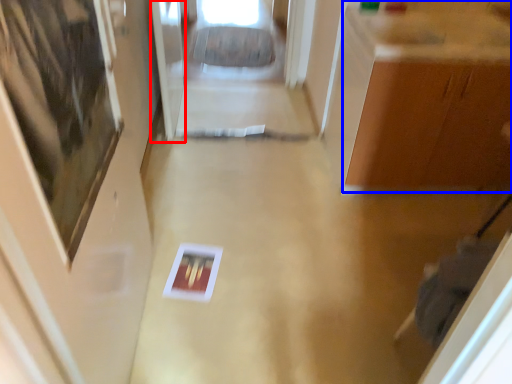
Question: Which of the following is the closest to the observer, glass door (highlighted by a red box) or cabinetry (highlighted by a blue box)?

Choices:
 (A) glass door
 (B) cabinetry

Answer: (B)